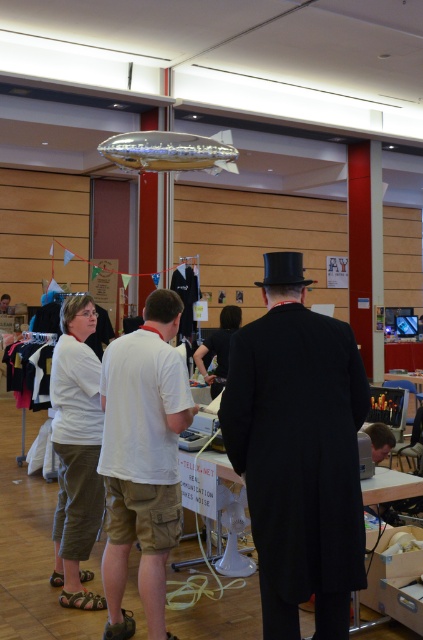
Question: Which point is closer to the camera?

Choices:
 (A) (129, 496)
 (B) (258, 506)

Answer: (B)

Question: Can you confirm if black matte coat at center is positioned above white cotton t-shirt at center?

Choices:
 (A) yes
 (B) no

Answer: (A)

Question: Is black matte coat at center behind white cotton t-shirt at center?

Choices:
 (A) yes
 (B) no

Answer: (B)

Question: Among these objects, which one is farthest from the camera?

Choices:
 (A) white cotton t-shirt at center
 (B) black matte coat at center

Answer: (A)

Question: Is black matte coat at center further to camera compared to white cotton t-shirt at center?

Choices:
 (A) yes
 (B) no

Answer: (B)